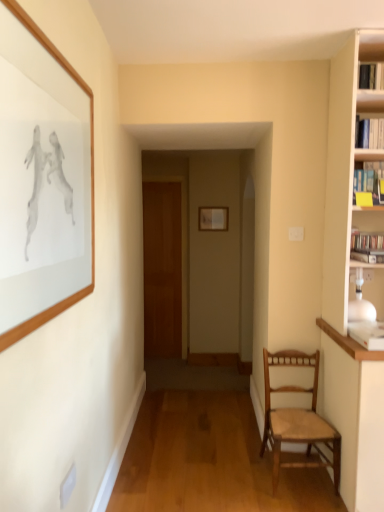
In order to face wooden woven seat chair at right, should I rotate leftwards or rightwards?

Turn right by 14.302 degrees to look at wooden woven seat chair at right.

Measure the distance between hardcover book at right and camera.

The depth of hardcover book at right is 2.08 meters.

This screenshot has width=384, height=512. What do you see at coordinates (213, 218) in the screenshot? I see `matte silver picture frame at center, which is counted as the first picture frame, starting from the right` at bounding box center [213, 218].

Locate an element on the screen. The image size is (384, 512). wooden woven seat chair at right is located at coordinates (297, 419).

From a real-world perspective, which is physically above, matte silver picture frame at center, placed as the second picture frame when sorted from left to right, or hardcover book at right?

matte silver picture frame at center, placed as the second picture frame when sorted from left to right, from a real-world perspective.

Considering the sizes of objects matte silver picture frame at center, which is the second picture frame in front-to-back order, and hardcover book at right in the image provided, who is thinner, matte silver picture frame at center, which is the second picture frame in front-to-back order, or hardcover book at right?

Thinner between the two is matte silver picture frame at center, which is the second picture frame in front-to-back order.

From the image's perspective, which is above, wooden woven seat chair at right or hardcover book at right?

hardcover book at right is shown above in the image.

Considering the sizes of objects wooden woven seat chair at right and hardcover book at right in the image provided, who is thinner, wooden woven seat chair at right or hardcover book at right?

With smaller width is hardcover book at right.

Which is behind, wooden woven seat chair at right or hardcover book at right?

hardcover book at right is behind.

From a real-world perspective, which is physically above, wooden woven seat chair at right or hardcover book at right?

In real-world perspective, hardcover book at right is above.

Is hardcover book at right not inside wooden door at center?

hardcover book at right is positioned outside wooden door at center.

From a real-world perspective, who is located higher, hardcover book at right or wooden door at center?

hardcover book at right.

Which is more to the left, hardcover book at right or wooden door at center?

wooden door at center is more to the left.

Is hardcover book at right far away from wooden door at center?

That's right, there is a large distance between hardcover book at right and wooden door at center.

Does wooden picture frame at upper left, marked as the 1th picture frame in a left-to-right arrangement, appear on the left side of matte silver picture frame at center, the 1th picture frame viewed from the back?

Yes, wooden picture frame at upper left, marked as the 1th picture frame in a left-to-right arrangement, is to the left of matte silver picture frame at center, the 1th picture frame viewed from the back.

Is wooden picture frame at upper left, marked as the second picture frame in a back-to-front arrangement, positioned beyond the bounds of matte silver picture frame at center, placed as the second picture frame when sorted from left to right?

wooden picture frame at upper left, marked as the second picture frame in a back-to-front arrangement, is positioned outside matte silver picture frame at center, placed as the second picture frame when sorted from left to right.

Is wooden picture frame at upper left, which is the second picture frame in right-to-left order, aimed at matte silver picture frame at center, which is the second picture frame in front-to-back order?

No, wooden picture frame at upper left, which is the second picture frame in right-to-left order, is not turned towards matte silver picture frame at center, which is the second picture frame in front-to-back order.

How much distance is there between hardcover book at right and wooden woven seat chair at right?

A distance of 38.10 inches exists between hardcover book at right and wooden woven seat chair at right.

Is hardcover book at right positioned far away from wooden woven seat chair at right?

No, hardcover book at right is in close proximity to wooden woven seat chair at right.

Which of these two, hardcover book at right or wooden woven seat chair at right, stands shorter?

With less height is hardcover book at right.

Where is `chair lying in front of the hardcover book at right`? This screenshot has height=512, width=384. chair lying in front of the hardcover book at right is located at coordinates (297, 419).

Between wooden woven seat chair at right and wooden picture frame at upper left, marked as the second picture frame in a back-to-front arrangement, which one appears on the right side from the viewer's perspective?

Positioned to the right is wooden woven seat chair at right.

Considering the sizes of objects wooden woven seat chair at right and wooden picture frame at upper left, which is the second picture frame in right-to-left order, in the image provided, who is thinner, wooden woven seat chair at right or wooden picture frame at upper left, which is the second picture frame in right-to-left order,?

With smaller width is wooden picture frame at upper left, which is the second picture frame in right-to-left order.

Where is `picture frame in front of the wooden woven seat chair at right`? picture frame in front of the wooden woven seat chair at right is located at coordinates (42, 179).

Is wooden door at center taller than wooden woven seat chair at right?

Indeed, wooden door at center has a greater height compared to wooden woven seat chair at right.

Does wooden door at center lie behind wooden woven seat chair at right?

Yes, wooden door at center is further from the camera.

How many degrees apart are the facing directions of wooden door at center and wooden woven seat chair at right?

The angular difference between wooden door at center and wooden woven seat chair at right is 0.346 degrees.

Which is correct: wooden door at center is inside wooden woven seat chair at right, or outside of it?

The correct answer is: outside.

Where is `the 1st picture frame located above the hardcover book at right (from a real-world perspective)`? the 1st picture frame located above the hardcover book at right (from a real-world perspective) is located at coordinates (213, 218).

Where is `chair below the hardcover book at right (from the image's perspective)`? The height and width of the screenshot is (512, 384). chair below the hardcover book at right (from the image's perspective) is located at coordinates (297, 419).

Looking at the image, which one is located closer to wooden door at center, wooden woven seat chair at right or wooden picture frame at upper left, marked as the 1th picture frame in a left-to-right arrangement?

wooden woven seat chair at right.

Which object lies nearer to the anchor point wooden woven seat chair at right, wooden door at center or matte silver picture frame at center, placed as the second picture frame when sorted from left to right?

Based on the image, matte silver picture frame at center, placed as the second picture frame when sorted from left to right, appears to be nearer to wooden woven seat chair at right.

From the image, which object appears to be farther from wooden door at center, wooden woven seat chair at right or hardcover book at right?

hardcover book at right lies further to wooden door at center than the other object.

Which object lies nearer to the anchor point hardcover book at right, matte silver picture frame at center, which is the second picture frame in front-to-back order, or wooden picture frame at upper left, which is the second picture frame in right-to-left order?

wooden picture frame at upper left, which is the second picture frame in right-to-left order.

Looking at the image, which one is located further to wooden woven seat chair at right, matte silver picture frame at center, which is counted as the first picture frame, starting from the right, or wooden door at center?

Among the two, wooden door at center is located further to wooden woven seat chair at right.

Estimate the real-world distances between objects in this image. Which object is further from hardcover book at right, matte silver picture frame at center, which is the second picture frame in front-to-back order, or wooden door at center?

Based on the image, wooden door at center appears to be further to hardcover book at right.

When comparing their distances from hardcover book at right, does wooden picture frame at upper left, the first picture frame positioned from the front, or wooden door at center seem further?

Based on the image, wooden door at center appears to be further to hardcover book at right.

Looking at the image, which one is located closer to wooden woven seat chair at right, wooden picture frame at upper left, the first picture frame positioned from the front, or matte silver picture frame at center, which is counted as the first picture frame, starting from the right?

wooden picture frame at upper left, the first picture frame positioned from the front, lies closer to wooden woven seat chair at right than the other object.

What are the coordinates of `chair between wooden picture frame at upper left, marked as the second picture frame in a back-to-front arrangement, and wooden door at center, along the z-axis` in the screenshot? It's located at (297, 419).

Identify the location of book between wooden picture frame at upper left, marked as the 1th picture frame in a left-to-right arrangement, and wooden door at center from front to back. (366, 241).

Where is `picture frame between wooden picture frame at upper left, the first picture frame positioned from the front, and wooden door at center from front to back`? picture frame between wooden picture frame at upper left, the first picture frame positioned from the front, and wooden door at center from front to back is located at coordinates (213, 218).

The image size is (384, 512). What are the coordinates of `book positioned between wooden woven seat chair at right and matte silver picture frame at center, which is counted as the first picture frame, starting from the right, from near to far` in the screenshot? It's located at (366, 241).